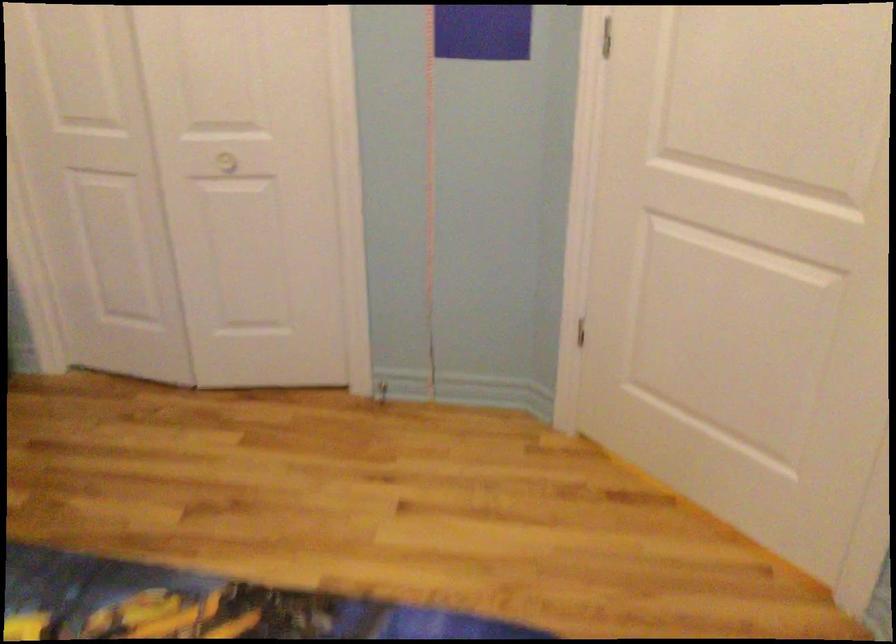
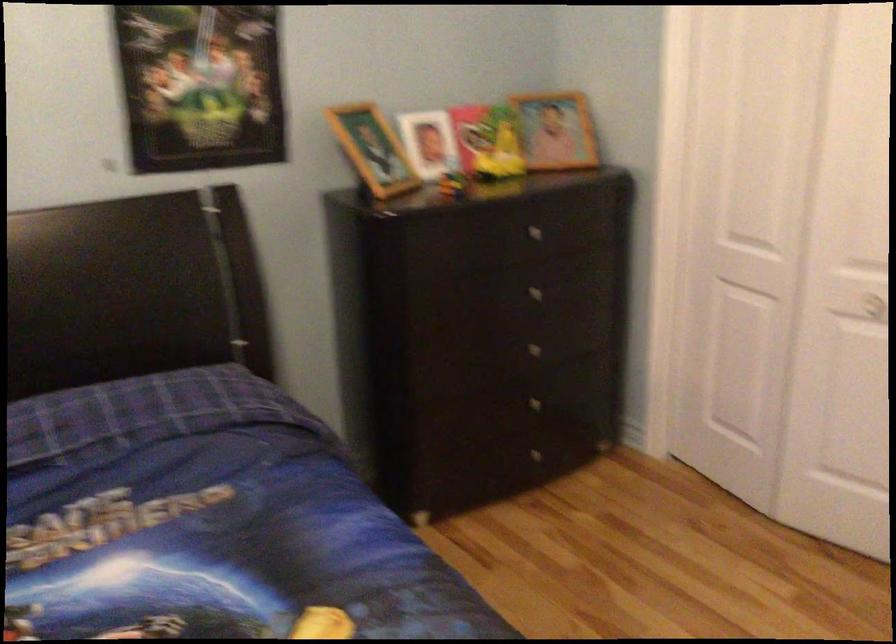
Question: The camera is either moving clockwise (left) or counter-clockwise (right) around the object. The first image is from the beginning of the video and the second image is from the end. Is the camera moving left or right when shooting the video?

Choices:
 (A) Left
 (B) Right

Answer: (B)